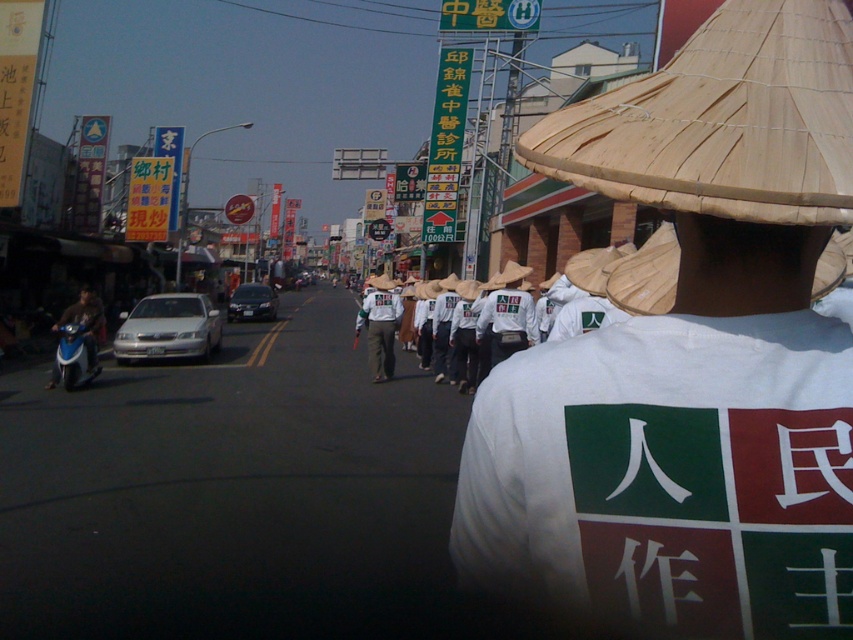
Can you confirm if white straw hat at center is positioned to the right of black matte helmet at center?

Indeed, white straw hat at center is positioned on the right side of black matte helmet at center.

Can you confirm if white straw hat at center is bigger than black matte helmet at center?

No.

Does point (666, 541) come behind point (91, 289)?

No.

Locate an element on the screen. Image resolution: width=853 pixels, height=640 pixels. white straw hat at center is located at coordinates (689, 356).

Which of these two, white straw hat at center or white cotton shirt at center, stands shorter?

Standing shorter between the two is white straw hat at center.

Does white straw hat at center appear on the left side of white cotton shirt at center?

Correct, you'll find white straw hat at center to the left of white cotton shirt at center.

This screenshot has height=640, width=853. In order to click on white straw hat at center in this screenshot , I will do `click(689, 356)`.

Who is more forward, (781, 176) or (380, 292)?

Point (781, 176) is more forward.

Between white straw hat at center and white matte shirt at center, which one is positioned higher?

white straw hat at center is higher up.

You are a GUI agent. You are given a task and a screenshot of the screen. Output one action in this format:
    pyautogui.click(x=<x>, y=<y>)
    Task: Click on the white straw hat at center
    The height and width of the screenshot is (640, 853).
    Given the screenshot: What is the action you would take?
    pyautogui.click(x=689, y=356)